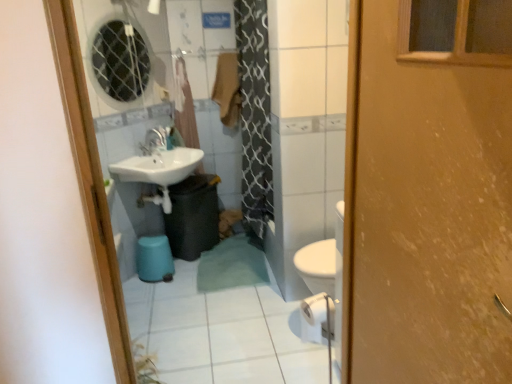
Question: From the image's perspective, does wooden door at right appear lower than translucent plastic curtain at upper center?

Choices:
 (A) no
 (B) yes

Answer: (B)

Question: Is wooden door at right closer to camera compared to translucent plastic curtain at upper center?

Choices:
 (A) yes
 (B) no

Answer: (A)

Question: Can you confirm if wooden door at right is thinner than translucent plastic curtain at upper center?

Choices:
 (A) no
 (B) yes

Answer: (A)

Question: Is wooden door at right outside of translucent plastic curtain at upper center?

Choices:
 (A) yes
 (B) no

Answer: (A)

Question: From a real-world perspective, is wooden door at right physically below translucent plastic curtain at upper center?

Choices:
 (A) yes
 (B) no

Answer: (A)

Question: Is black plastic trash can at lower center wider or thinner than wooden door at right?

Choices:
 (A) wide
 (B) thin

Answer: (A)

Question: Considering the positions of point (187, 183) and point (384, 36), is point (187, 183) closer or farther from the camera than point (384, 36)?

Choices:
 (A) closer
 (B) farther

Answer: (B)

Question: From the image's perspective, relative to wooden door at right, is black plastic trash can at lower center above or below?

Choices:
 (A) above
 (B) below

Answer: (A)

Question: From a real-world perspective, is black plastic trash can at lower center physically located above or below wooden door at right?

Choices:
 (A) above
 (B) below

Answer: (B)

Question: Is transparent glass mirror at upper left in front of or behind matte blue stool at lower left in the image?

Choices:
 (A) behind
 (B) front

Answer: (B)

Question: From a real-world perspective, relative to matte blue stool at lower left, is transparent glass mirror at upper left vertically above or below?

Choices:
 (A) below
 (B) above

Answer: (B)

Question: Is transparent glass mirror at upper left inside or outside of matte blue stool at lower left?

Choices:
 (A) inside
 (B) outside

Answer: (B)

Question: Considering the positions of point (138, 74) and point (160, 243), is point (138, 74) closer or farther from the camera than point (160, 243)?

Choices:
 (A) farther
 (B) closer

Answer: (A)

Question: In terms of size, does matte white faucet at center appear bigger or smaller than translucent plastic curtain at upper center?

Choices:
 (A) small
 (B) big

Answer: (A)

Question: From a real-world perspective, is matte white faucet at center above or below translucent plastic curtain at upper center?

Choices:
 (A) below
 (B) above

Answer: (A)